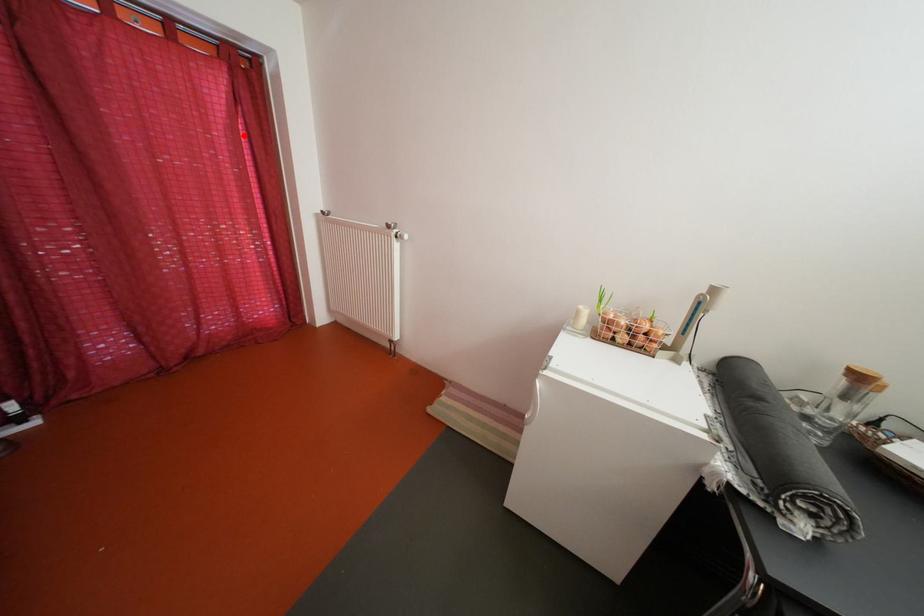
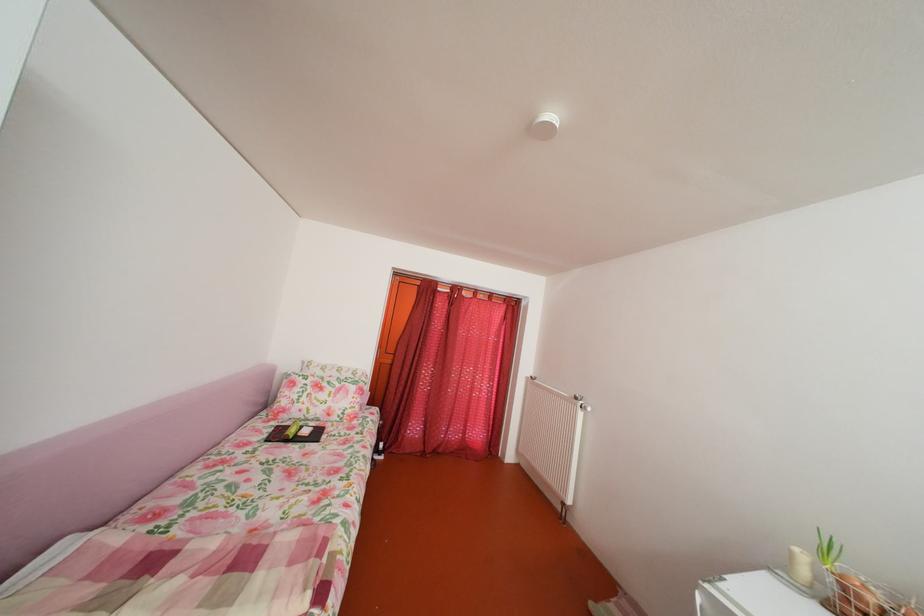
In the second image, find the point that corresponds to the highlighted location in the first image.

(511, 337)